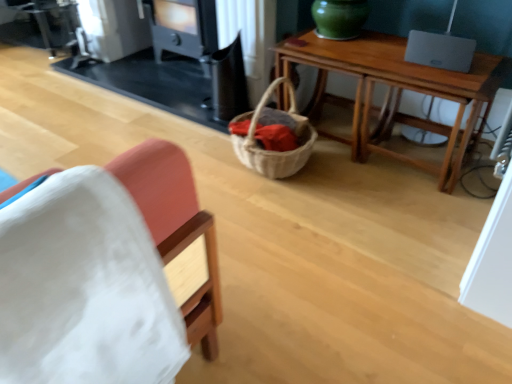
Describe the element at coordinates (176, 227) in the screenshot. I see `white fabric chair at left` at that location.

I want to click on wooden table at center, so click(396, 93).

What's the angular difference between black matte fireplace at upper center and wooden table at center's facing directions?

0.0885 degrees separate the facing orientations of black matte fireplace at upper center and wooden table at center.

From a real-world perspective, is black matte fireplace at upper center physically located above or below wooden table at center?

black matte fireplace at upper center is above wooden table at center.

Does black matte fireplace at upper center have a lesser width compared to wooden table at center?

In fact, black matte fireplace at upper center might be wider than wooden table at center.

Is black matte stove at upper center oriented away from black matte fireplace at upper center?

That's right, black matte stove at upper center is facing away from black matte fireplace at upper center.

The image size is (512, 384). In order to click on fireplace lying in front of the black matte stove at upper center in this screenshot , I will do `click(153, 82)`.

Which of these two, black matte stove at upper center or black matte fireplace at upper center, stands shorter?

Standing shorter between the two is black matte stove at upper center.

From the image's perspective, which is above, black matte fireplace at upper center or white fabric chair at left?

From the image's view, black matte fireplace at upper center is above.

Do you think black matte fireplace at upper center is within white fabric chair at left, or outside of it?

black matte fireplace at upper center is spatially situated outside white fabric chair at left.

Considering the relative positions of black matte fireplace at upper center and white fabric chair at left in the image provided, is black matte fireplace at upper center behind white fabric chair at left?

Yes, the depth of black matte fireplace at upper center is greater than that of white fabric chair at left.

Considering the sizes of objects black matte fireplace at upper center and white fabric chair at left in the image provided, who is wider, black matte fireplace at upper center or white fabric chair at left?

black matte fireplace at upper center.

Can you confirm if wooden table at center is positioned to the right of white fabric chair at left?

Correct, you'll find wooden table at center to the right of white fabric chair at left.

In order to click on table behind the white fabric chair at left in this screenshot , I will do `click(396, 93)`.

Is white fabric chair at left at the back of wooden table at center?

No, wooden table at center is not facing away from white fabric chair at left.

Can you tell me how much black matte fireplace at upper center and black matte stove at upper center differ in facing direction?

0.000114 degrees separate the facing orientations of black matte fireplace at upper center and black matte stove at upper center.

Which is further, (123,84) or (197,0)?

The point (123,84) is more distant.

Can you confirm if black matte fireplace at upper center is taller than black matte stove at upper center?

Yes, black matte fireplace at upper center is taller than black matte stove at upper center.

Which of these two, black matte fireplace at upper center or black matte stove at upper center, is smaller?

Smaller between the two is black matte stove at upper center.

From a real-world perspective, which is physically above, black matte stove at upper center or wooden table at center?

black matte stove at upper center is physically above.

Which of these two, black matte stove at upper center or wooden table at center, is wider?

Wider between the two is wooden table at center.

Is wooden table at center located within black matte stove at upper center?

No, wooden table at center is located outside of black matte stove at upper center.

Can you confirm if black matte stove at upper center is taller than wooden table at center?

No, black matte stove at upper center is not taller than wooden table at center.

Is wooden table at center next to black matte stove at upper center and touching it?

wooden table at center is not next to black matte stove at upper center, and they're not touching.

Which of these two, wooden table at center or black matte stove at upper center, is smaller?

black matte stove at upper center is smaller.

Locate an element on the screen. table below the black matte stove at upper center (from the image's perspective) is located at coordinates (396, 93).

Is wooden table at center inside the boundaries of black matte stove at upper center, or outside?

wooden table at center is spatially situated outside black matte stove at upper center.

Where is `table in front of the black matte fireplace at upper center`? This screenshot has height=384, width=512. table in front of the black matte fireplace at upper center is located at coordinates click(x=396, y=93).

The width and height of the screenshot is (512, 384). Find the location of `stove below the black matte fireplace at upper center (from a real-world perspective)`. stove below the black matte fireplace at upper center (from a real-world perspective) is located at coordinates (183, 27).

From the image, which object appears to be nearer to black matte fireplace at upper center, black matte stove at upper center or white fabric chair at left?

black matte stove at upper center is closer to black matte fireplace at upper center.

Estimate the real-world distances between objects in this image. Which object is closer to wooden table at center, black matte stove at upper center or white fabric chair at left?

black matte stove at upper center is closer to wooden table at center.

From the image, which object appears to be nearer to black matte fireplace at upper center, wooden table at center or white fabric chair at left?

The object closer to black matte fireplace at upper center is wooden table at center.

Which object lies nearer to the anchor point wooden table at center, white fabric chair at left or black matte fireplace at upper center?

Among the two, black matte fireplace at upper center is located nearer to wooden table at center.

Looking at the image, which one is located further to white fabric chair at left, black matte stove at upper center or wooden table at center?

black matte stove at upper center is further to white fabric chair at left.

Considering their positions, is wooden table at center positioned further to black matte stove at upper center than white fabric chair at left?

white fabric chair at left lies further to black matte stove at upper center than the other object.

From the picture: When comparing their distances from black matte stove at upper center, does black matte fireplace at upper center or white fabric chair at left seem further?

white fabric chair at left lies further to black matte stove at upper center than the other object.

Estimate the real-world distances between objects in this image. Which object is closer to white fabric chair at left, black matte fireplace at upper center or wooden table at center?

Based on the image, wooden table at center appears to be nearer to white fabric chair at left.

Image resolution: width=512 pixels, height=384 pixels. I want to click on table located between white fabric chair at left and black matte fireplace at upper center in the depth direction, so click(x=396, y=93).

Locate an element on the screen. Image resolution: width=512 pixels, height=384 pixels. table located between white fabric chair at left and black matte stove at upper center in the depth direction is located at coordinates (396, 93).

What are the coordinates of `fireplace positioned between white fabric chair at left and black matte stove at upper center from near to far` in the screenshot? It's located at (153, 82).

The height and width of the screenshot is (384, 512). I want to click on stove located between black matte fireplace at upper center and wooden table at center in the left-right direction, so click(183, 27).